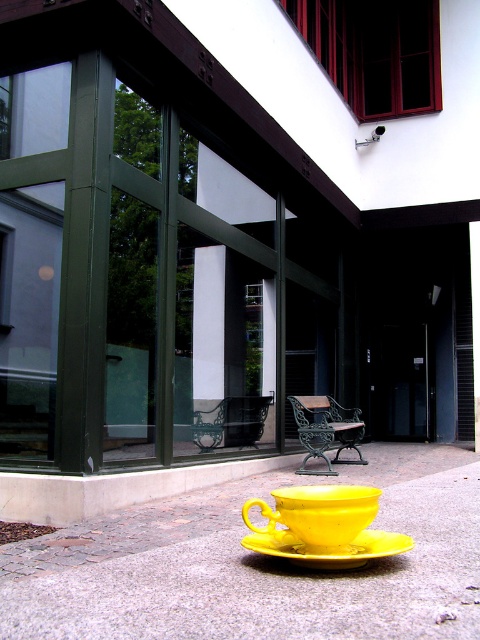
Between yellow matte teacup at lower center and yellow matte/satin saucer at lower center, which one has more height?

yellow matte teacup at lower center

Which is in front, point (276, 532) or point (259, 541)?

Point (259, 541) is more forward.

Identify the location of yellow matte teacup at lower center. The image size is (480, 640). (319, 515).

Which is in front, point (74, 506) or point (294, 545)?

Point (294, 545)

Measure the distance from yellow ceramic cup at lower center to yellow matte/satin saucer at lower center.

yellow ceramic cup at lower center and yellow matte/satin saucer at lower center are 2.39 meters apart from each other.

Locate an element on the screen. The width and height of the screenshot is (480, 640). yellow ceramic cup at lower center is located at coordinates (204, 481).

Where is `yellow ceramic cup at lower center`? This screenshot has width=480, height=640. yellow ceramic cup at lower center is located at coordinates (204, 481).

Can you confirm if yellow ceramic cup at center is wider than yellow matte teacup at lower center?

Yes.

What do you see at coordinates (252, 568) in the screenshot? I see `yellow ceramic cup at center` at bounding box center [252, 568].

At what (x,y) coordinates should I click in order to perform the action: click on yellow ceramic cup at center. Please return your answer as a coordinate pair (x, y). Looking at the image, I should click on (252, 568).